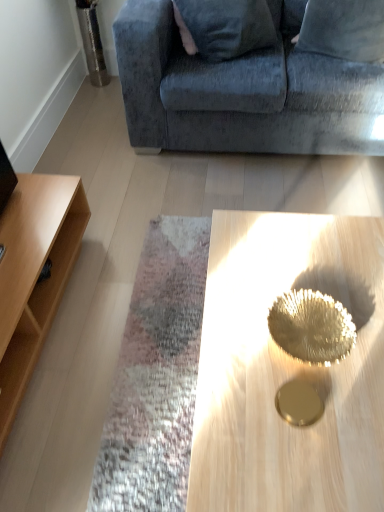
Identify the location of vacant space behind light wood shelf at left. (120, 190).